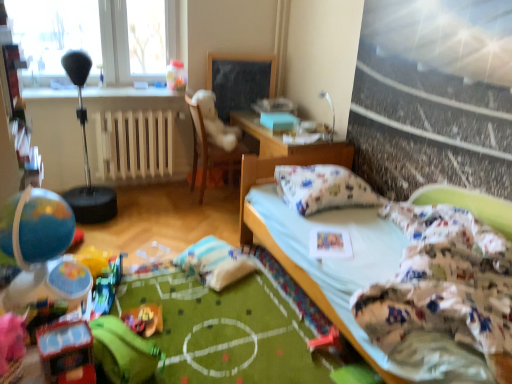
Question: Are shiny plastic toy car at lower left, which appears as the fourth toy when viewed from the left, and white wooden radiator at center beside each other?

Choices:
 (A) yes
 (B) no

Answer: (B)

Question: From the image's perspective, is shiny plastic toy car at lower left, which is the fifth toy in back-to-front order, on top of white wooden radiator at center?

Choices:
 (A) no
 (B) yes

Answer: (A)

Question: Could you tell me if shiny plastic toy car at lower left, which ranks as the second toy in right-to-left order, is facing white wooden radiator at center?

Choices:
 (A) yes
 (B) no

Answer: (B)

Question: From a real-world perspective, is shiny plastic toy car at lower left, which ranks as the second toy in right-to-left order, on top of white wooden radiator at center?

Choices:
 (A) yes
 (B) no

Answer: (A)

Question: Is shiny plastic toy car at lower left, which is the fifth toy in back-to-front order, in front of white wooden radiator at center?

Choices:
 (A) no
 (B) yes

Answer: (B)

Question: Is shiny plastic toy car at lower left, which is the first toy in front-to-back order, wider than white wooden radiator at center?

Choices:
 (A) yes
 (B) no

Answer: (B)

Question: Does black chalkboard at center have a greater height compared to rubber pink toy at lower center, the 1th toy positioned from the right?

Choices:
 (A) yes
 (B) no

Answer: (A)

Question: Is black chalkboard at center wider than rubber pink toy at lower center, the 1th toy from the bottom?

Choices:
 (A) yes
 (B) no

Answer: (B)

Question: Considering the relative sizes of black chalkboard at center and rubber pink toy at lower center, which is the third toy in back-to-front order, in the image provided, is black chalkboard at center thinner than rubber pink toy at lower center, which is the third toy in back-to-front order,?

Choices:
 (A) yes
 (B) no

Answer: (A)

Question: From the image's perspective, would you say black chalkboard at center is positioned over rubber pink toy at lower center, the 1th toy from the bottom?

Choices:
 (A) no
 (B) yes

Answer: (B)

Question: Is black chalkboard at center facing towards rubber pink toy at lower center, placed as the 5th toy when sorted from top to bottom?

Choices:
 (A) yes
 (B) no

Answer: (A)

Question: Does black chalkboard at center have a larger size compared to rubber pink toy at lower center, the 1th toy from the bottom?

Choices:
 (A) no
 (B) yes

Answer: (B)

Question: From the image's perspective, is matte plastic globe at left, which is the 4th toy from bottom to top, under white wooden radiator at center?

Choices:
 (A) yes
 (B) no

Answer: (A)